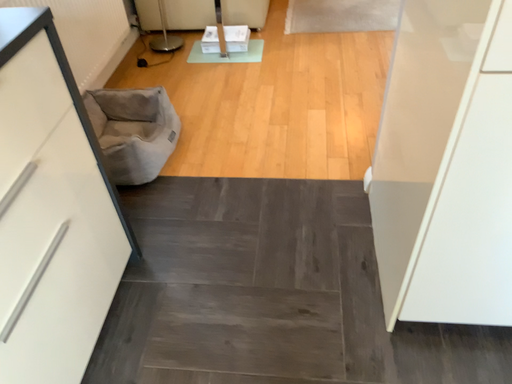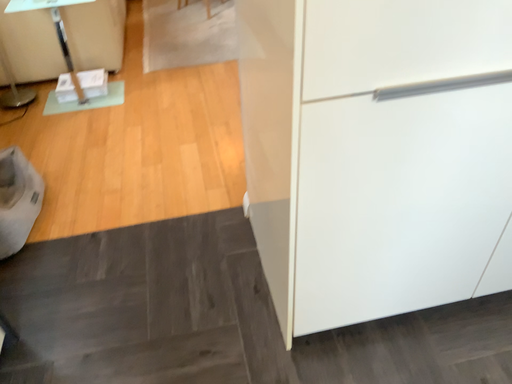
Question: How did the camera likely rotate when shooting the video?

Choices:
 (A) rotated left
 (B) rotated right

Answer: (B)